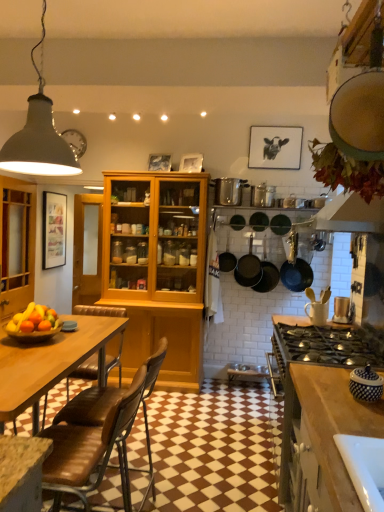
Question: Considering the relative sizes of matte black frying pan at center, which is the 2th frying pan from right to left, and brown leather chair at lower left in the image provided, is matte black frying pan at center, which is the 2th frying pan from right to left, smaller than brown leather chair at lower left?

Choices:
 (A) no
 (B) yes

Answer: (B)

Question: From a real-world perspective, is matte black frying pan at center, the 1th frying pan positioned from the left, located beneath brown leather chair at lower left?

Choices:
 (A) no
 (B) yes

Answer: (A)

Question: Considering the relative sizes of matte black frying pan at center, which is the 2th frying pan from right to left, and brown leather chair at lower left in the image provided, is matte black frying pan at center, which is the 2th frying pan from right to left, wider than brown leather chair at lower left?

Choices:
 (A) no
 (B) yes

Answer: (A)

Question: Is matte black frying pan at center, the 1th frying pan positioned from the left, to the right of brown leather chair at lower left from the viewer's perspective?

Choices:
 (A) yes
 (B) no

Answer: (A)

Question: Is matte black frying pan at center, the 1th frying pan positioned from the left, turned away from brown leather chair at lower left?

Choices:
 (A) no
 (B) yes

Answer: (A)

Question: Is silver metallic pot at center, the third appliance positioned from the right, bigger or smaller than matte black pan at upper right, arranged as the 1th kitchen appliance when viewed from the right?

Choices:
 (A) big
 (B) small

Answer: (B)

Question: From a real-world perspective, is silver metallic pot at center, placed as the 1th appliance when sorted from left to right, above or below matte black pan at upper right, arranged as the 1th kitchen appliance when viewed from the right?

Choices:
 (A) below
 (B) above

Answer: (B)

Question: Is silver metallic pot at center, the 1th appliance viewed from the top, spatially inside matte black pan at upper right, which is the 3th kitchen appliance in left-to-right order, or outside of it?

Choices:
 (A) outside
 (B) inside

Answer: (A)

Question: From the image's perspective, is silver metallic pot at center, the 1th appliance viewed from the top, above or below matte black pan at upper right, arranged as the 1th kitchen appliance when viewed from the right?

Choices:
 (A) below
 (B) above

Answer: (B)

Question: In terms of width, does black matte pans at center, placed as the 2th kitchen appliance when sorted from left to right, look wider or thinner when compared to wooden bowl at lower left?

Choices:
 (A) thin
 (B) wide

Answer: (A)

Question: Based on their positions, is black matte pans at center, placed as the 2th kitchen appliance when sorted from left to right, located to the left or right of wooden bowl at lower left?

Choices:
 (A) left
 (B) right

Answer: (B)

Question: Based on their sizes in the image, would you say black matte pans at center, arranged as the 2th kitchen appliance when viewed from the right, is bigger or smaller than wooden bowl at lower left?

Choices:
 (A) big
 (B) small

Answer: (A)

Question: In terms of height, does black matte pans at center, arranged as the 2th kitchen appliance when viewed from the right, look taller or shorter compared to wooden bowl at lower left?

Choices:
 (A) tall
 (B) short

Answer: (A)

Question: From a real-world perspective, relative to matte black pans at center, marked as the first kitchen appliance in a left-to-right arrangement, is matte black frying pan at center, marked as the second frying pan in a left-to-right arrangement, vertically above or below?

Choices:
 (A) above
 (B) below

Answer: (A)

Question: Is matte black frying pan at center, marked as the second frying pan in a left-to-right arrangement, to the left or to the right of matte black pans at center, marked as the first kitchen appliance in a left-to-right arrangement, in the image?

Choices:
 (A) left
 (B) right

Answer: (B)